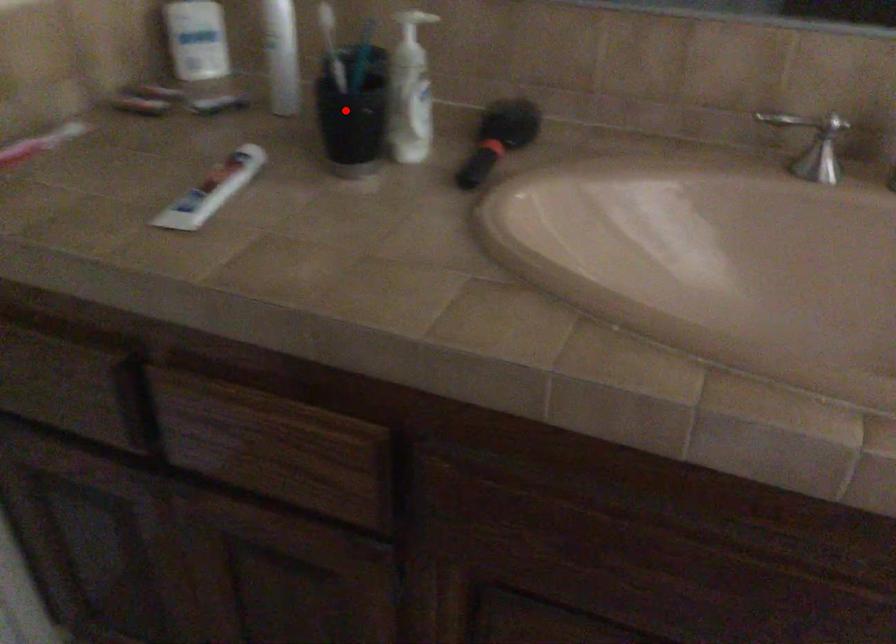
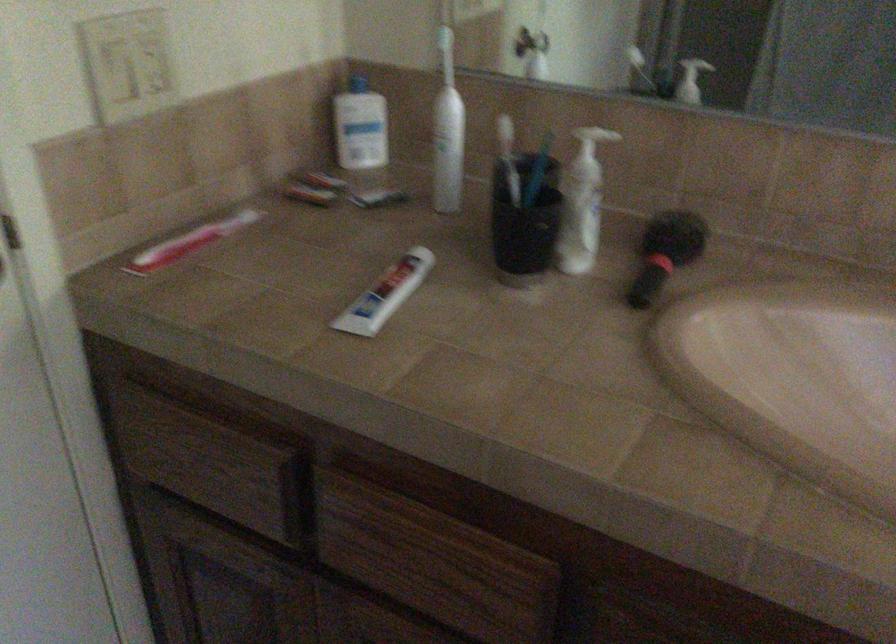
Find the pixel in the second image that matches the highlighted location in the first image.

(524, 222)